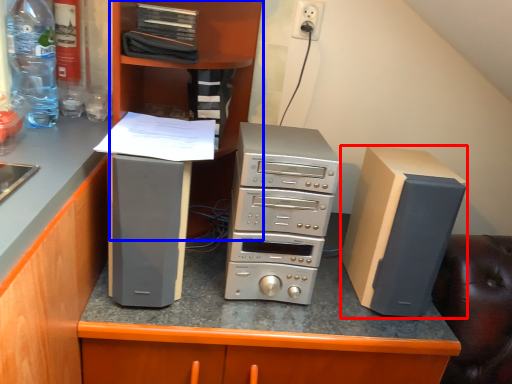
Question: Which object is further to the camera taking this photo, computer tower (highlighted by a red box) or bookshelf (highlighted by a blue box)?

Choices:
 (A) computer tower
 (B) bookshelf

Answer: (A)